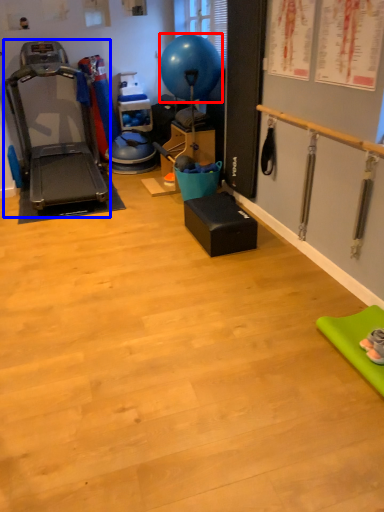
Question: Which of the following is the farthest to the observer, balloon (highlighted by a red box) or treadmill (highlighted by a blue box)?

Choices:
 (A) balloon
 (B) treadmill

Answer: (A)